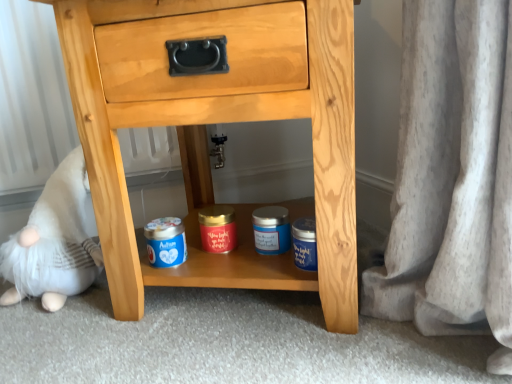
Question: Should I look upward or downward to see natural wood chest of drawers at center?

Choices:
 (A) up
 (B) down

Answer: (A)

Question: Is the position of white plush toy at lower left less distant than that of natural wood chest of drawers at center?

Choices:
 (A) yes
 (B) no

Answer: (B)

Question: From the image's perspective, is white plush toy at lower left located above natural wood chest of drawers at center?

Choices:
 (A) yes
 (B) no

Answer: (B)

Question: Is white plush toy at lower left surrounding natural wood chest of drawers at center?

Choices:
 (A) yes
 (B) no

Answer: (B)

Question: From a real-world perspective, is white plush toy at lower left on natural wood chest of drawers at center?

Choices:
 (A) yes
 (B) no

Answer: (B)

Question: From the image's perspective, is white plush toy at lower left located beneath natural wood chest of drawers at center?

Choices:
 (A) yes
 (B) no

Answer: (A)

Question: Is white plush toy at lower left outside of natural wood chest of drawers at center?

Choices:
 (A) no
 (B) yes

Answer: (B)

Question: Is natural wood chest of drawers at center thinner than white plush toy at lower left?

Choices:
 (A) no
 (B) yes

Answer: (A)

Question: Is natural wood chest of drawers at center further to the viewer compared to white plush toy at lower left?

Choices:
 (A) yes
 (B) no

Answer: (B)

Question: From a real-world perspective, does natural wood chest of drawers at center sit lower than white plush toy at lower left?

Choices:
 (A) yes
 (B) no

Answer: (B)

Question: Can you confirm if natural wood chest of drawers at center is wider than white plush toy at lower left?

Choices:
 (A) no
 (B) yes

Answer: (B)

Question: Considering the relative positions of natural wood chest of drawers at center and white plush toy at lower left in the image provided, is natural wood chest of drawers at center to the right of white plush toy at lower left from the viewer's perspective?

Choices:
 (A) no
 (B) yes

Answer: (B)

Question: Is white plush toy at lower left at the back of natural wood chest of drawers at center?

Choices:
 (A) no
 (B) yes

Answer: (A)

Question: Is natural wood chest of drawers at center in front of or behind white plush toy at lower left in the image?

Choices:
 (A) front
 (B) behind

Answer: (A)